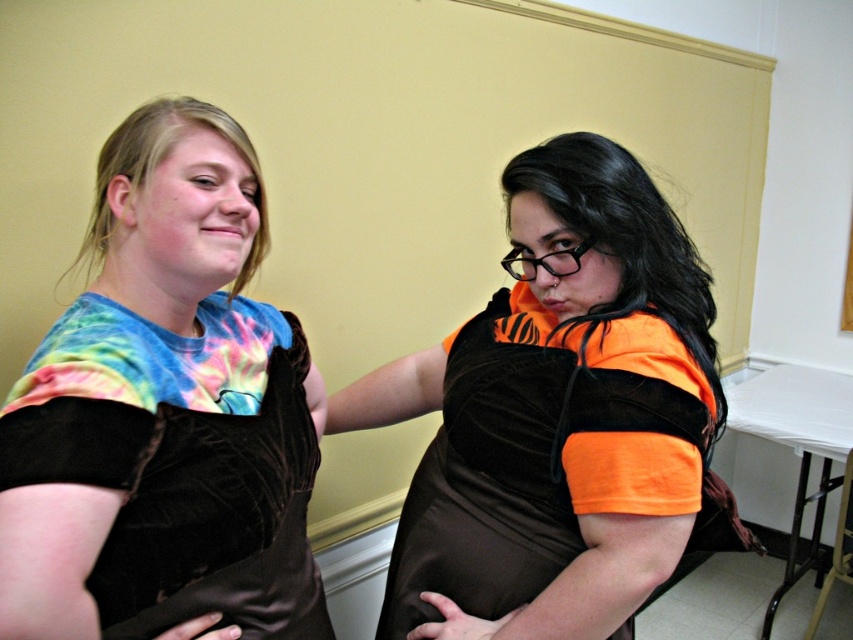
Question: Which point is farther from the camera taking this photo?

Choices:
 (A) (660, 264)
 (B) (252, 580)

Answer: (A)

Question: Is tie-dye fabric shirt at left thinner than velvet brown dress at center?

Choices:
 (A) yes
 (B) no

Answer: (A)

Question: Among these objects, which one is farthest from the camera?

Choices:
 (A) tie-dye fabric shirt at left
 (B) velvet brown dress at center

Answer: (B)

Question: Can you confirm if tie-dye fabric shirt at left is positioned to the right of velvet brown dress at center?

Choices:
 (A) yes
 (B) no

Answer: (B)

Question: Is tie-dye fabric shirt at left to the right of velvet brown dress at center from the viewer's perspective?

Choices:
 (A) yes
 (B) no

Answer: (B)

Question: Which object is farther from the camera taking this photo?

Choices:
 (A) velvet brown dress at center
 (B) tie-dye fabric shirt at left

Answer: (A)